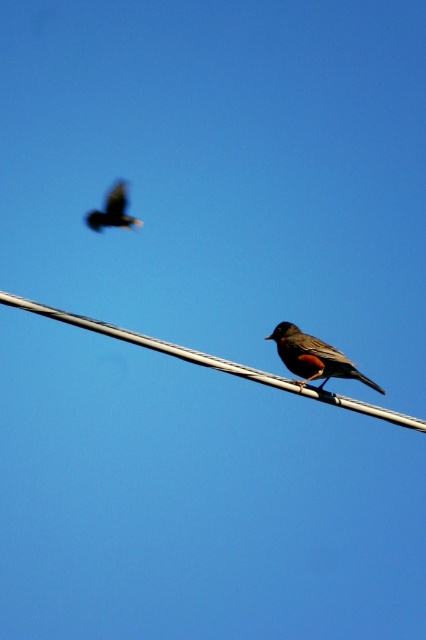
Question: From the image, what is the correct spatial relationship of metallic wire at center in relation to brown matte bird at center?

Choices:
 (A) above
 (B) below

Answer: (A)

Question: Does metallic wire at center appear under dark brown feathers at upper left?

Choices:
 (A) yes
 (B) no

Answer: (A)

Question: Which point is closer to the camera?

Choices:
 (A) (299, 387)
 (B) (124, 198)

Answer: (A)

Question: Which point appears farthest from the camera in this image?

Choices:
 (A) (112, 196)
 (B) (310, 378)
 (C) (273, 385)

Answer: (A)

Question: Is metallic wire at center further to camera compared to brown matte bird at center?

Choices:
 (A) yes
 (B) no

Answer: (B)

Question: Based on their relative distances, which object is farther from the dark brown feathers at upper left?

Choices:
 (A) metallic wire at center
 (B) brown matte bird at center

Answer: (A)